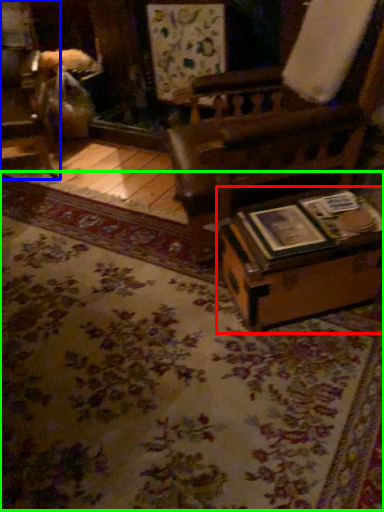
Question: Estimate the real-world distances between objects in this image. Which object is closer to table (highlighted by a red box), furniture (highlighted by a blue box) or mat (highlighted by a green box)?

Choices:
 (A) furniture
 (B) mat

Answer: (B)